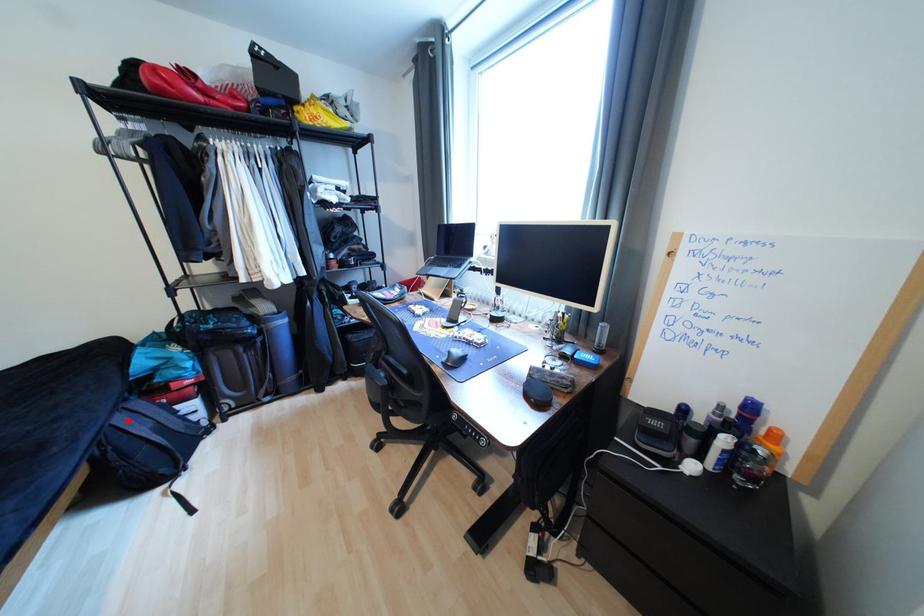
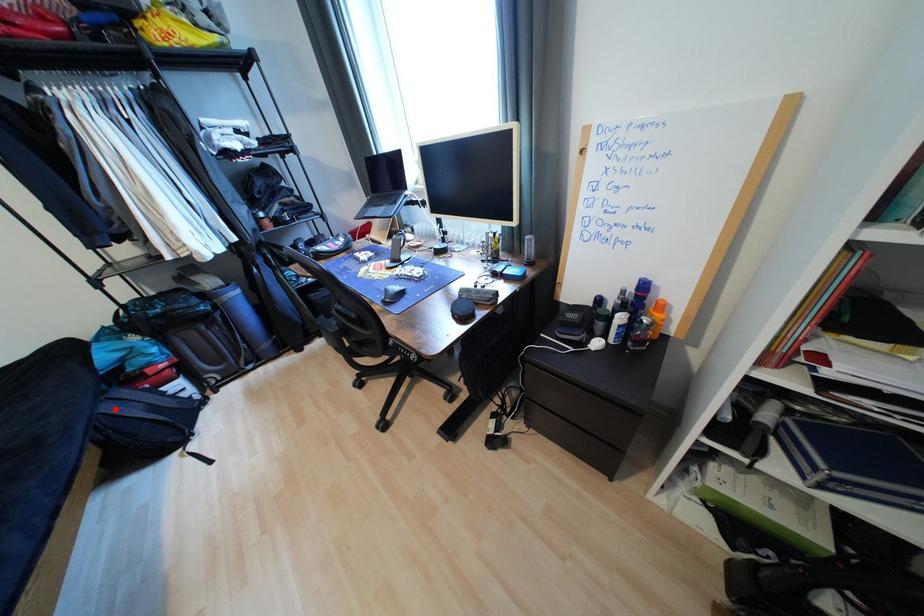
I am providing you with two images of the same scene from different viewpoints. A red point is marked on the first image and another point is marked on the second image. Does the point marked in image1 correspond to the same location as the one in image2?

Yes